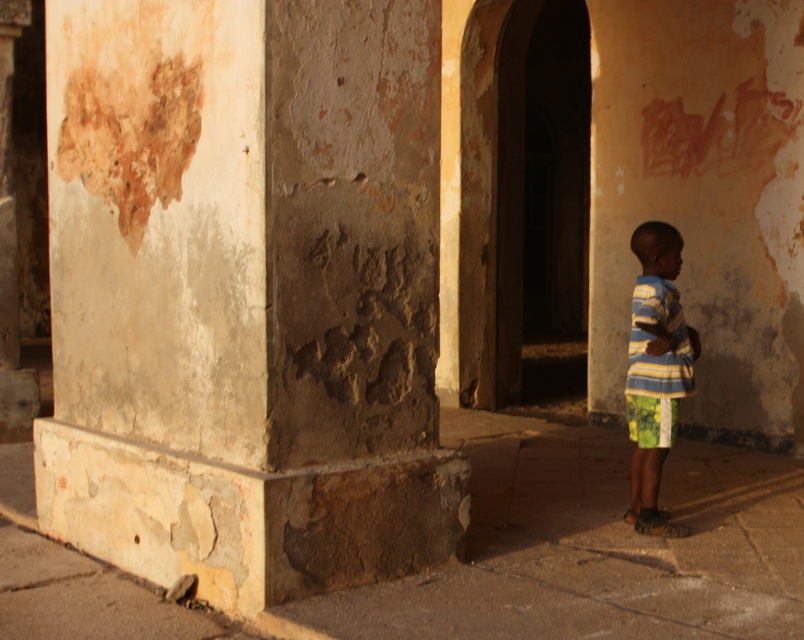
You are a tour guide leading a group through this historical building. You want to ensure everyone can see the rusty concrete pillar at center from where they are standing. If the average person can see clearly up to 4 meters away, will the group need to move closer to the pillar?

The rusty concrete pillar at center is 4.18 meters away from the viewer. Since the average person can see clearly up to 4 meters, the group will need to move closer to the pillar to ensure everyone can see it clearly.

You are a photographer trying to capture the striped fabric shirt at right in the frame. The camera you are using has a focal length of 50mm and an aperture of f2.8. Based on the scene description, can you determine if the shirt is within the camera sensor area?

The striped fabric shirt at right is positioned at point (655, 371), which is within the camera sensor area. Therefore, the shirt should be captured in the frame.

You are a tailor measuring clothes for a child. You have a striped fabric shirt at right and green fabric shorts at lower right. Which clothing item is longer in height?

The striped fabric shirt at right is much taller than the green fabric shorts at lower right, so the shirt is longer in height.